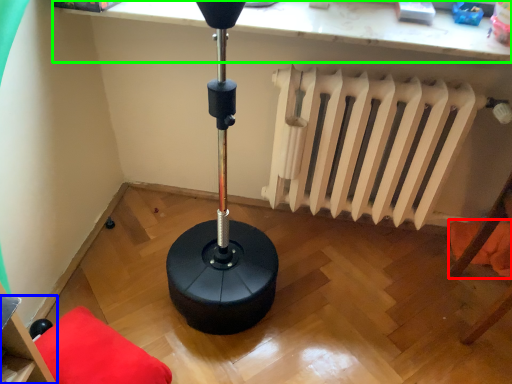
Question: Which object is positioned closest to pillow (highlighted by a red box)? Select from furniture (highlighted by a blue box) and computer (highlighted by a green box).

Choices:
 (A) furniture
 (B) computer

Answer: (B)